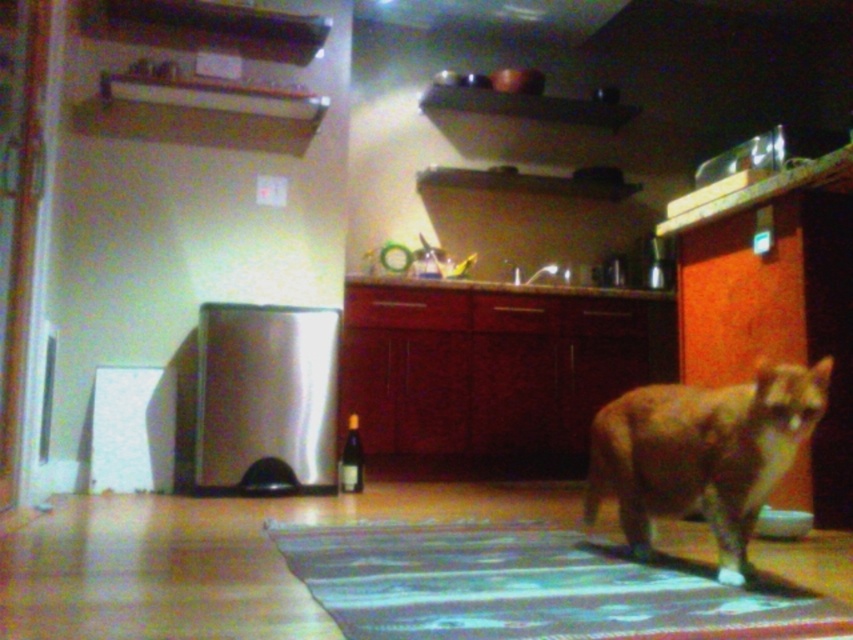
You are standing in the kitchen and see two points marked in the image. Which point is closer to you, point (660, 564) or point (683, 406)?

Point (660, 564) is further to the viewer than point (683, 406), so point (683, 406) is closer to you.

You are a cat owner who wants to ensure your orange fur cat at center has enough space to move freely on the blue textured rug at center. Based on the scene description, can the cat comfortably move around on the rug?

The blue textured rug at center is larger in size than orange fur cat at center, so yes, the cat can comfortably move around on the rug since it has more space than its size.